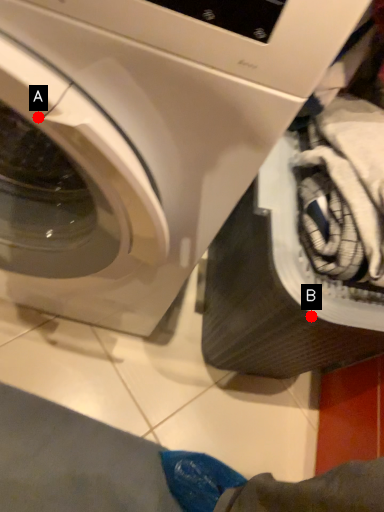
Question: Two points are circled on the image, labeled by A and B beside each circle. Which point is further to the camera?

Choices:
 (A) A is further
 (B) B is further

Answer: (B)